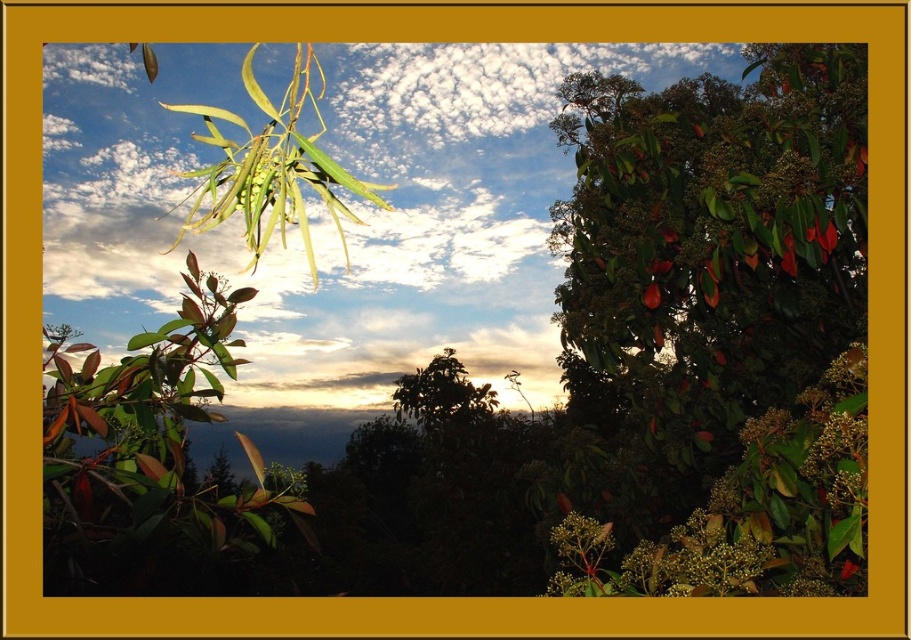
You are an artist painting the landscape and want to ensure the white fluffy cloud at upper center and the green glossy leaves at upper center are proportionally accurate. Based on their positions in the scene, which object should appear larger in your painting?

The white fluffy cloud at upper center should appear larger in the painting because it is taller than the green glossy leaves at upper center.

You are an astronomer analyzing the sky in the image. You notice the white fluffy cloud at upper center. What are its coordinates in the image?

The white fluffy cloud at upper center is located at coordinates (325, 212).